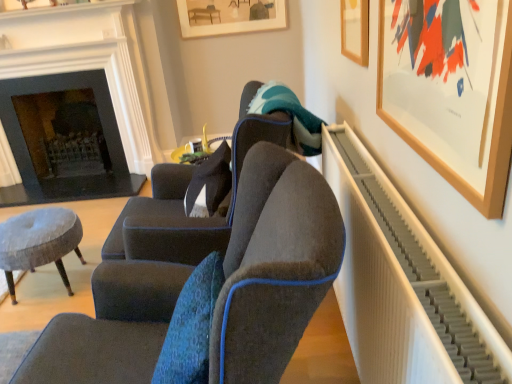
Question: From a real-world perspective, is dark gray stone fireplace at left located beneath wooden picture frame at upper right, placed as the 2th picture frame when sorted from top to bottom?

Choices:
 (A) no
 (B) yes

Answer: (B)

Question: Is dark gray stone fireplace at left surrounding wooden picture frame at upper right, placed as the 2th picture frame when sorted from top to bottom?

Choices:
 (A) yes
 (B) no

Answer: (B)

Question: Does dark gray stone fireplace at left have a lesser height compared to wooden picture frame at upper right, which appears as the second picture frame when viewed from the front?

Choices:
 (A) yes
 (B) no

Answer: (B)

Question: Is dark gray stone fireplace at left at the left side of wooden picture frame at upper right, placed as the 2th picture frame when sorted from top to bottom?

Choices:
 (A) yes
 (B) no

Answer: (A)

Question: Can you see dark gray stone fireplace at left touching wooden picture frame at upper right, positioned as the 2th picture frame in right-to-left order?

Choices:
 (A) yes
 (B) no

Answer: (B)

Question: Is the position of dark gray stone fireplace at left less distant than that of wooden picture frame at upper right, which appears as the second picture frame when viewed from the front?

Choices:
 (A) yes
 (B) no

Answer: (B)

Question: Does wooden picture frame at upper right, the 1th picture frame in the right-to-left sequence, appear on the right side of velvet grey stool at lower left?

Choices:
 (A) no
 (B) yes

Answer: (B)

Question: Is wooden picture frame at upper right, the third picture frame positioned from the top, bigger than velvet grey stool at lower left?

Choices:
 (A) no
 (B) yes

Answer: (A)

Question: Can you confirm if wooden picture frame at upper right, which appears as the 1th picture frame when viewed from the front, is thinner than velvet grey stool at lower left?

Choices:
 (A) no
 (B) yes

Answer: (B)

Question: Is wooden picture frame at upper right, which ranks as the first picture frame in bottom-to-top order, to the left of velvet grey stool at lower left from the viewer's perspective?

Choices:
 (A) no
 (B) yes

Answer: (A)

Question: Is wooden picture frame at upper right, the 3th picture frame viewed from the back, next to velvet grey stool at lower left?

Choices:
 (A) yes
 (B) no

Answer: (B)

Question: Is wooden picture frame at upper right, the 1th picture frame in the right-to-left sequence, turned away from velvet grey stool at lower left?

Choices:
 (A) no
 (B) yes

Answer: (A)

Question: Is wooden picture frame at upper right, positioned as the 2th picture frame in right-to-left order, completely or partially outside of wooden picture frame at upper right, the 1th picture frame in the right-to-left sequence?

Choices:
 (A) yes
 (B) no

Answer: (A)